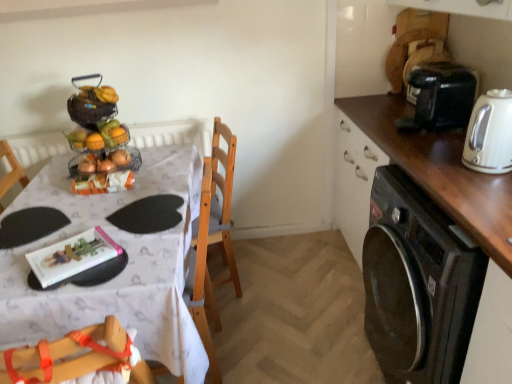
Locate an element on the screen. This screenshot has height=384, width=512. white paper at left is located at coordinates (71, 259).

What do you see at coordinates (71, 259) in the screenshot? I see `white paper at left` at bounding box center [71, 259].

The width and height of the screenshot is (512, 384). I want to click on black plastic coffee machine at upper right, so click(439, 96).

This screenshot has width=512, height=384. What do you see at coordinates (439, 96) in the screenshot? I see `black plastic coffee machine at upper right` at bounding box center [439, 96].

The image size is (512, 384). What are the coordinates of `white glossy table at upper left` in the screenshot? It's located at (121, 272).

In order to face metallic wire fruit stand at upper left, should I rotate leftwards or rightwards?

To face it directly, rotate left by 20.571 degrees.

What do you see at coordinates (99, 139) in the screenshot? The width and height of the screenshot is (512, 384). I see `metallic wire fruit stand at upper left` at bounding box center [99, 139].

Where is `white paper at left`? white paper at left is located at coordinates (71, 259).

Which object is thinner, black glossy dishwasher at lower right or white glossy electric kettle at right?

white glossy electric kettle at right.

How many degrees apart are the facing directions of black glossy dishwasher at lower right and white glossy electric kettle at right?

The facing directions of black glossy dishwasher at lower right and white glossy electric kettle at right are 0.99 degrees apart.

Considering the sizes of black glossy dishwasher at lower right and white glossy electric kettle at right in the image, is black glossy dishwasher at lower right bigger or smaller than white glossy electric kettle at right?

Clearly, black glossy dishwasher at lower right is larger in size than white glossy electric kettle at right.

From the image's perspective, is black glossy dishwasher at lower right over white glossy electric kettle at right?

No, from the image's perspective, black glossy dishwasher at lower right is not above white glossy electric kettle at right.

Based on the photo, is wooden chair at center, the second chair viewed from the front, facing away from metallic wire fruit stand at upper left?

That's not correct — wooden chair at center, the second chair viewed from the front, is not looking away from metallic wire fruit stand at upper left.

Who is taller, wooden chair at center, the second chair viewed from the front, or metallic wire fruit stand at upper left?

wooden chair at center, the second chair viewed from the front, is taller.

Do you think wooden chair at center, which ranks as the 1th chair in back-to-front order, is within metallic wire fruit stand at upper left, or outside of it?

wooden chair at center, which ranks as the 1th chair in back-to-front order, is outside metallic wire fruit stand at upper left.

Between point (207, 281) and point (74, 99), which one is positioned behind?

The point (74, 99) is farther from the camera.

Based on the photo, which is nearer, (91, 191) or (62, 273)?

Clearly, point (91, 191) is more distant from the camera than point (62, 273).

Considering their positions, is metallic wire fruit stand at upper left located in front of or behind white paper at left?

Clearly, metallic wire fruit stand at upper left is behind white paper at left.

From the image's perspective, which is below, metallic wire fruit stand at upper left or white paper at left?

From the image's view, white paper at left is below.

Based on the photo, is there a large distance between metallic wire fruit stand at upper left and white paper at left?

metallic wire fruit stand at upper left is near white paper at left, not far away.

Considering the positions of objects black matte paper plate at lower left and wooden chair at lower left, which ranks as the first chair in front-to-back order, in the image provided, who is in front, black matte paper plate at lower left or wooden chair at lower left, which ranks as the first chair in front-to-back order,?

Positioned in front is wooden chair at lower left, which ranks as the first chair in front-to-back order.

Between point (11, 232) and point (49, 348), which one is positioned behind?

The point (11, 232) is farther.

Which object is positioned more to the left, black matte paper plate at lower left or wooden chair at lower left, which ranks as the first chair in front-to-back order?

From the viewer's perspective, black matte paper plate at lower left appears more on the left side.

What's the angular difference between black matte paper plate at lower left and wooden chair at lower left, which ranks as the first chair in front-to-back order,'s facing directions?

90 degrees.

Looking at this image, which is nearer, (53, 261) or (79, 159)?

Point (53, 261)

Is wire mesh basket at center at the back of white paper at left?

white paper at left is not turned away from wire mesh basket at center.

Identify the location of basket located above the white paper at left (from the image's perspective). (132, 159).

From a real-world perspective, who is located higher, white paper at left or wire mesh basket at center?

wire mesh basket at center, from a real-world perspective.

Does black matte paper plate at lower left have a lesser height compared to wooden chair at center, which ranks as the 1th chair in back-to-front order?

Yes, black matte paper plate at lower left is shorter than wooden chair at center, which ranks as the 1th chair in back-to-front order.

Would you say black matte paper plate at lower left is a long distance from wooden chair at center, the second chair viewed from the front?

Actually, black matte paper plate at lower left and wooden chair at center, the second chair viewed from the front, are a little close together.

Is black matte paper plate at lower left facing away from wooden chair at center, which ranks as the 1th chair in back-to-front order?

No.

From the image's perspective, between black matte paper plate at lower left and wooden chair at center, the second chair viewed from the front, who is located below?

black matte paper plate at lower left.

Which object is closer to the camera, metallic wire fruit stand at upper left or white glossy table at upper left?

white glossy table at upper left is in front.

At what (x,y) coordinates should I click in order to perform the action: click on table below the metallic wire fruit stand at upper left (from a real-world perspective). Please return your answer as a coordinate pair (x, y). The height and width of the screenshot is (384, 512). Looking at the image, I should click on (121, 272).

Looking at their sizes, would you say metallic wire fruit stand at upper left is wider or thinner than white glossy table at upper left?

In the image, metallic wire fruit stand at upper left appears to be more narrow than white glossy table at upper left.

How different are the orientations of metallic wire fruit stand at upper left and white glossy table at upper left in degrees?

The angular difference between metallic wire fruit stand at upper left and white glossy table at upper left is 1.63 degrees.

In the image, there is a black glossy dishwasher at lower right. At what (x,y) coordinates should I click in order to perform the action: click on kitchen appliance above it (from the image's perspective). Please return your answer as a coordinate pair (x, y). The width and height of the screenshot is (512, 384). Looking at the image, I should click on (490, 134).

From the image's perspective, count 1st chairs downward from the metallic wire fruit stand at upper left and point to it. Please provide its 2D coordinates.

[(216, 219)]

From the image, which object appears to be nearer to white paper at left, shiny metallic fruit basket at upper left or wooden chair at center, which ranks as the 1th chair in back-to-front order?

Among the two, wooden chair at center, which ranks as the 1th chair in back-to-front order, is located nearer to white paper at left.

Estimate the real-world distances between objects in this image. Which object is further from black glossy dishwasher at lower right, white glossy electric kettle at right or wooden chair at lower left, which ranks as the first chair in front-to-back order?

wooden chair at lower left, which ranks as the first chair in front-to-back order, is further to black glossy dishwasher at lower right.

Which object lies nearer to the anchor point white glossy electric kettle at right, metallic wire fruit stand at upper left or black plastic coffee machine at upper right?

Based on the image, black plastic coffee machine at upper right appears to be nearer to white glossy electric kettle at right.

Based on their spatial positions, is wooden chair at center, the second chair viewed from the front, or black glossy dishwasher at lower right further from wooden chair at lower left, arranged as the 2th chair when viewed from the back?

The object further to wooden chair at lower left, arranged as the 2th chair when viewed from the back, is black glossy dishwasher at lower right.

Based on their spatial positions, is wooden chair at center, which ranks as the 1th chair in back-to-front order, or black glossy dishwasher at lower right closer to shiny metallic fruit basket at upper left?

The object closer to shiny metallic fruit basket at upper left is wooden chair at center, which ranks as the 1th chair in back-to-front order.

Considering their positions, is black matte paper plate at lower left positioned closer to black glossy dishwasher at lower right than white glossy electric kettle at right?

white glossy electric kettle at right lies closer to black glossy dishwasher at lower right than the other object.

Which object lies further to the anchor point wooden chair at lower left, arranged as the 2th chair when viewed from the back, black matte paper plate at lower left or white glossy table at upper left?

Based on the image, black matte paper plate at lower left appears to be further to wooden chair at lower left, arranged as the 2th chair when viewed from the back.

Estimate the real-world distances between objects in this image. Which object is further from white glossy table at upper left, black glossy dishwasher at lower right or black matte paper plate at lower left?

Based on the image, black glossy dishwasher at lower right appears to be further to white glossy table at upper left.

Find the location of `food positioned between white glossy table at upper left and wire mesh basket at center from near to far`. food positioned between white glossy table at upper left and wire mesh basket at center from near to far is located at coordinates (99, 139).

You are a GUI agent. You are given a task and a screenshot of the screen. Output one action in this format:
    pyautogui.click(x=<x>, y=<y>)
    Task: Click on the food between black matte paper plate at lower left and white glossy electric kettle at right from left to right
    This screenshot has height=384, width=512.
    Given the screenshot: What is the action you would take?
    99,139

At what (x,y) coordinates should I click in order to perform the action: click on fruit between black matte paper plate at lower left and wire mesh basket at center along the z-axis. Please return your answer as a coordinate pair (x, y). Looking at the image, I should click on (100, 137).

The width and height of the screenshot is (512, 384). What are the coordinates of `paper plate between white glossy table at upper left and wire mesh basket at center along the z-axis` in the screenshot? It's located at (30, 225).